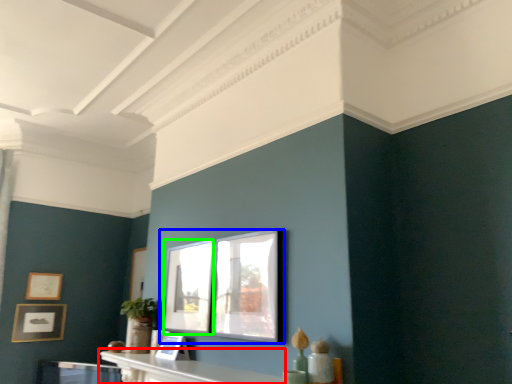
Question: Which is nearer to the table (highlighted by a red box)? picture frame (highlighted by a blue box) or window (highlighted by a green box).

Choices:
 (A) picture frame
 (B) window

Answer: (A)